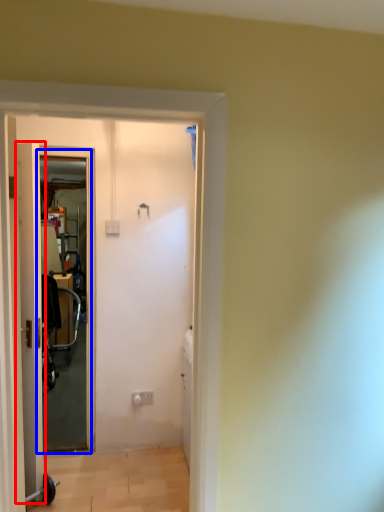
Question: Which object is closer to the camera taking this photo, door (highlighted by a red box) or screen door (highlighted by a blue box)?

Choices:
 (A) door
 (B) screen door

Answer: (A)